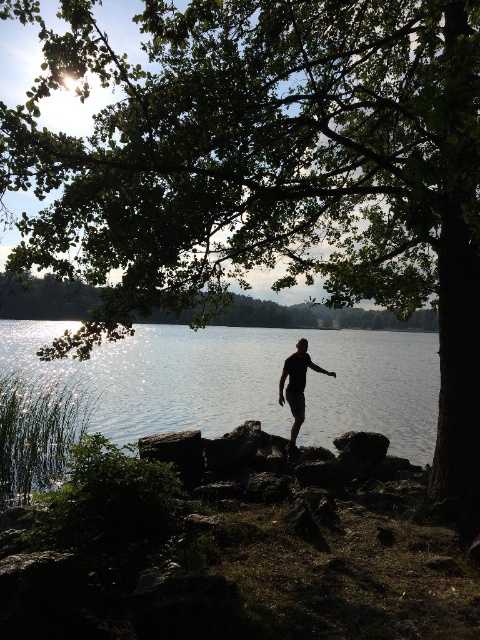
You are standing at the point marked as point (67, 324) and want to reach the other side of the lake. The distance between you and the opposite shore is 16.60 meters. If your boat can carry a maximum load of 200 kilograms, and you weigh 75 kilograms, how many 15 kilogram items can you safely carry without exceeding the boat limit?

You can safely carry 8 items. Here is the calculation step by step. First, subtract your weight from the boat limit to find the available weight capacity for items. 200 kg minus 75 kg equals 125 kg. Next, divide the available capacity by the weight of each item. 125 kg divided by 15 kg per item equals approximately 8.33. Since you can only carry whole items, you round down to 8 items. This ensures the total weight stays within the boat limit.

You are standing at the lakeside and want to cross to the other side. You see clear water at center and black matte shorts at center. Which path should you choose to avoid getting your feet wet?

You should choose the path over the black matte shorts at center since the clear water at center is larger in size and likely deeper, making it more likely to get your feet wet.